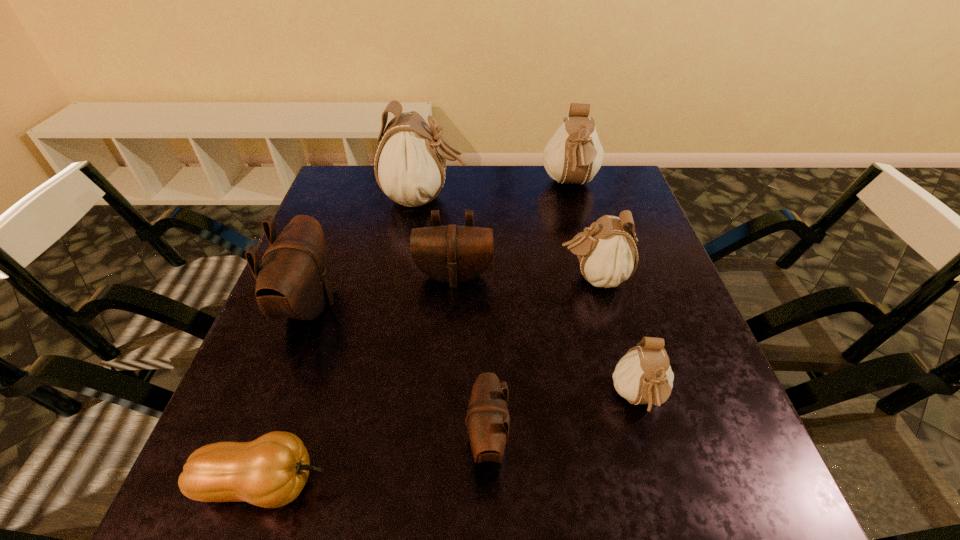
At what (x,y) coordinates should I click in order to perform the action: click on the biggest white pouch. Please return your answer as a coordinate pair (x, y). Looking at the image, I should click on (410, 165).

This screenshot has height=540, width=960. I want to click on the tallest object, so click(x=410, y=165).

Image resolution: width=960 pixels, height=540 pixels. What are the coordinates of `the third smallest white pouch` in the screenshot? It's located at (574, 154).

The height and width of the screenshot is (540, 960). What are the coordinates of `the biggest brown pouch` in the screenshot? It's located at (293, 281).

At what (x,y) coordinates should I click in order to perform the action: click on the leftmost brown pouch. Please return your answer as a coordinate pair (x, y). The image size is (960, 540). Looking at the image, I should click on (293, 281).

Identify the location of the second smallest white pouch. (607, 253).

Locate an element on the screen. the second smallest brown pouch is located at coordinates (453, 254).

Image resolution: width=960 pixels, height=540 pixels. I want to click on the smallest white pouch, so click(x=643, y=376).

Find the location of a particular element. This screenshot has width=960, height=540. the nearest brown pouch is located at coordinates (488, 421).

Image resolution: width=960 pixels, height=540 pixels. I want to click on gourd, so click(271, 471).